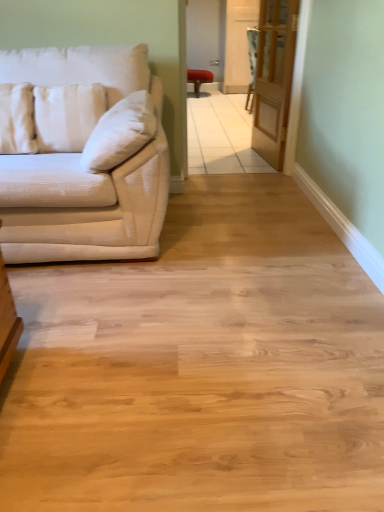
Identify the location of empty space that is to the right of matte white couch at left. This screenshot has height=512, width=384. (240, 241).